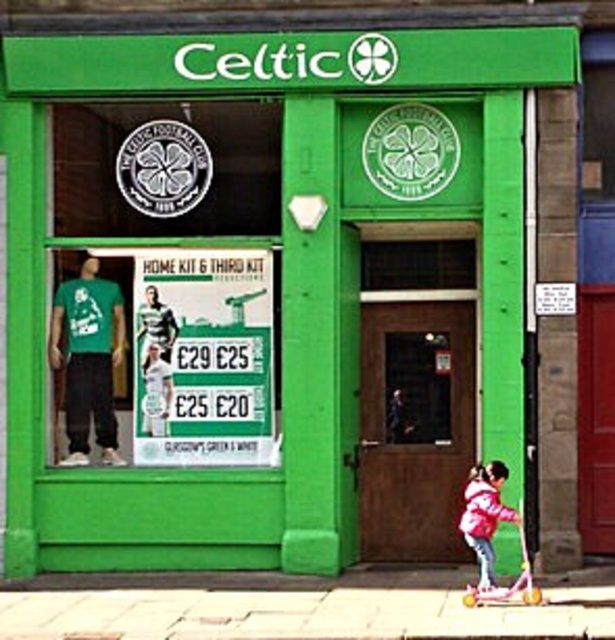
You are a pedestrian standing in front of the Celtic Football Club merchandise shop. You see the paved stone pavement at lower center and the pink fabric jacket at lower right. Which object takes up more space in the image?

The pink fabric jacket at lower right takes up more space in the image because the paved stone pavement at lower center is smaller than the pink fabric jacket at lower right.

You are standing in front of the Celtic Football Club merchandise shop. You see the paved stone pavement at lower center and the pink fabric jacket at lower right. Which object is positioned more to the right side of the scene?

The paved stone pavement at lower center is positioned more to the right side of the scene compared to the pink fabric jacket at lower right.